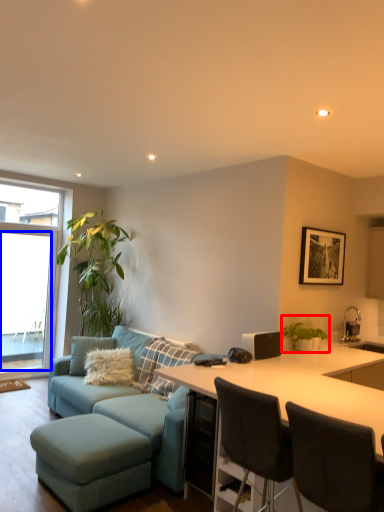
Question: Which object is closer to the camera taking this photo, houseplant (highlighted by a red box) or window screen (highlighted by a blue box)?

Choices:
 (A) houseplant
 (B) window screen

Answer: (A)